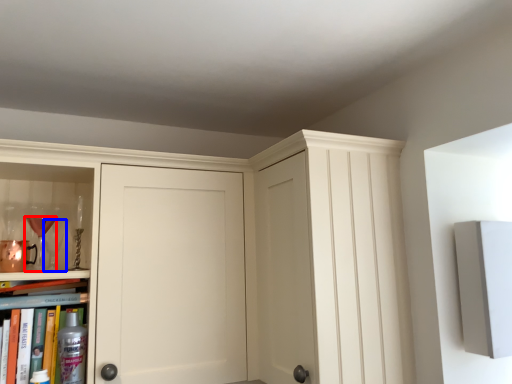
Question: Among these objects, which one is nearest to the camera, wine glass (highlighted by a red box) or wine glass (highlighted by a blue box)?

Choices:
 (A) wine glass
 (B) wine glass

Answer: (A)